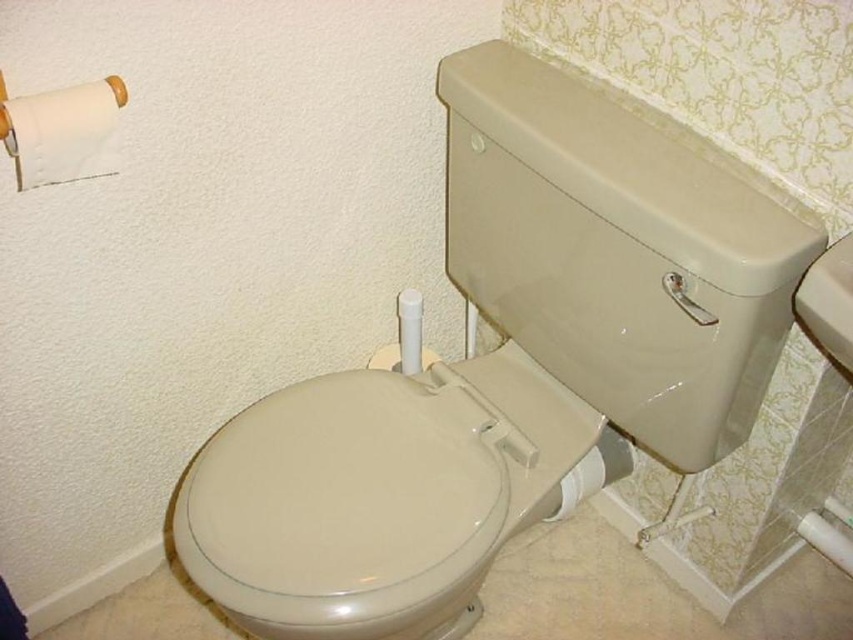
Question: Among these objects, which one is nearest to the camera?

Choices:
 (A) white matte toilet paper at upper left
 (B) beige glossy toilet bowl at center
 (C) white glossy toilet paper at lower right

Answer: (A)

Question: Which point is closer to the camera?

Choices:
 (A) (604, 465)
 (B) (109, 147)
 (C) (721, 262)

Answer: (C)

Question: In this image, where is beige glossy toilet bowl at center located relative to white glossy toilet paper at lower right?

Choices:
 (A) left
 (B) right

Answer: (A)

Question: Which point is closer to the camera?

Choices:
 (A) (51, 148)
 (B) (538, 316)

Answer: (A)

Question: Does white matte toilet paper at upper left lie behind white glossy toilet paper at lower right?

Choices:
 (A) yes
 (B) no

Answer: (B)

Question: Is the position of beige glossy toilet bowl at center more distant than that of white matte toilet paper at upper left?

Choices:
 (A) yes
 (B) no

Answer: (A)